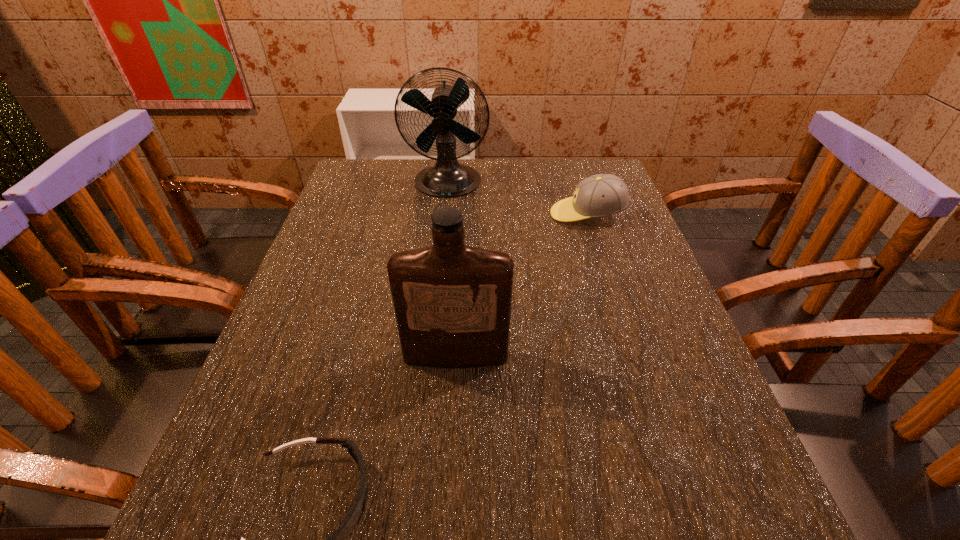
The height and width of the screenshot is (540, 960). I want to click on object that is at the right edge, so click(600, 195).

At what (x,y) coordinates should I click in order to perform the action: click on vacant space at the far edge. Please return your answer as a coordinate pair (x, y). Image resolution: width=960 pixels, height=540 pixels. Looking at the image, I should click on (432, 165).

Where is `vacant space at the left edge of the desktop`? The height and width of the screenshot is (540, 960). vacant space at the left edge of the desktop is located at coordinates (325, 434).

Find the location of a particular element. vacant space at the right edge is located at coordinates (645, 271).

Where is `blank space at the far left corner`? Image resolution: width=960 pixels, height=540 pixels. blank space at the far left corner is located at coordinates (396, 164).

In the image, there is a desktop. Where is `free space at the far right corner`? free space at the far right corner is located at coordinates (601, 173).

Identify the location of free spot at the near right corner of the desktop. (717, 531).

Find the location of a particular element. This screenshot has height=540, width=960. free space between the liquor and the second shortest object is located at coordinates 521,285.

Where is `free space between the fan and the baseball cap`? The image size is (960, 540). free space between the fan and the baseball cap is located at coordinates (x=517, y=199).

You are a GUI agent. You are given a task and a screenshot of the screen. Output one action in this format:
    pyautogui.click(x=<x>, y=<y>)
    Task: Click on the free space between the third farthest object and the baseball cap
    
    Given the screenshot: What is the action you would take?
    (x=521, y=285)